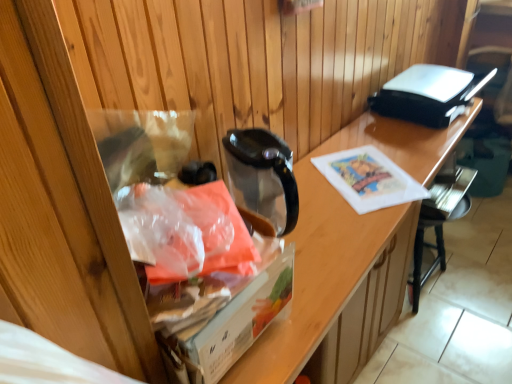
Question: Is translucent plastic bag at left outside transparent plastic bag at left?

Choices:
 (A) no
 (B) yes

Answer: (B)

Question: Can you see translucent plastic bag at left touching transparent plastic bag at left?

Choices:
 (A) no
 (B) yes

Answer: (A)

Question: Considering the relative sizes of translucent plastic bag at left and transparent plastic bag at left in the image provided, is translucent plastic bag at left smaller than transparent plastic bag at left?

Choices:
 (A) no
 (B) yes

Answer: (B)

Question: Can you confirm if translucent plastic bag at left is wider than transparent plastic bag at left?

Choices:
 (A) no
 (B) yes

Answer: (A)

Question: From a real-world perspective, is translucent plastic bag at left over transparent plastic bag at left?

Choices:
 (A) yes
 (B) no

Answer: (A)

Question: Can transparent plastic bag at left be found inside translucent plastic bag at left?

Choices:
 (A) yes
 (B) no

Answer: (B)

Question: Would you say translucent plastic bag at left is outside black plastic toaster at upper right?

Choices:
 (A) yes
 (B) no

Answer: (A)

Question: Is black plastic toaster at upper right inside translucent plastic bag at left?

Choices:
 (A) yes
 (B) no

Answer: (B)

Question: From the image's perspective, does translucent plastic bag at left appear lower than black plastic toaster at upper right?

Choices:
 (A) yes
 (B) no

Answer: (A)

Question: Considering the relative positions of translucent plastic bag at left and black plastic toaster at upper right in the image provided, is translucent plastic bag at left to the right of black plastic toaster at upper right from the viewer's perspective?

Choices:
 (A) no
 (B) yes

Answer: (A)

Question: Is the depth of translucent plastic bag at left less than that of black plastic toaster at upper right?

Choices:
 (A) yes
 (B) no

Answer: (A)

Question: From a real-world perspective, is translucent plastic bag at left over black plastic toaster at upper right?

Choices:
 (A) yes
 (B) no

Answer: (A)

Question: Is black plastic chair at lower right facing away from translucent plastic bag at left?

Choices:
 (A) yes
 (B) no

Answer: (B)